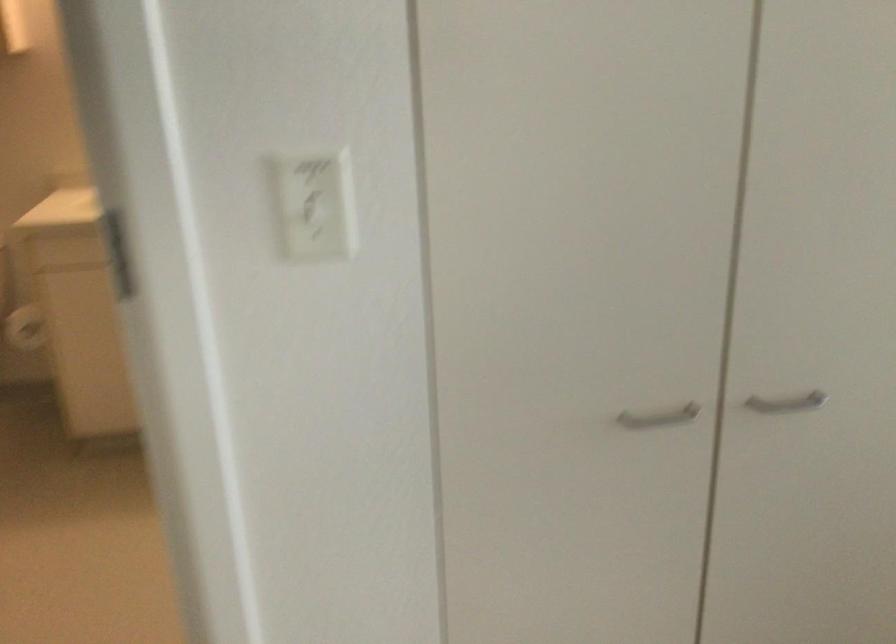
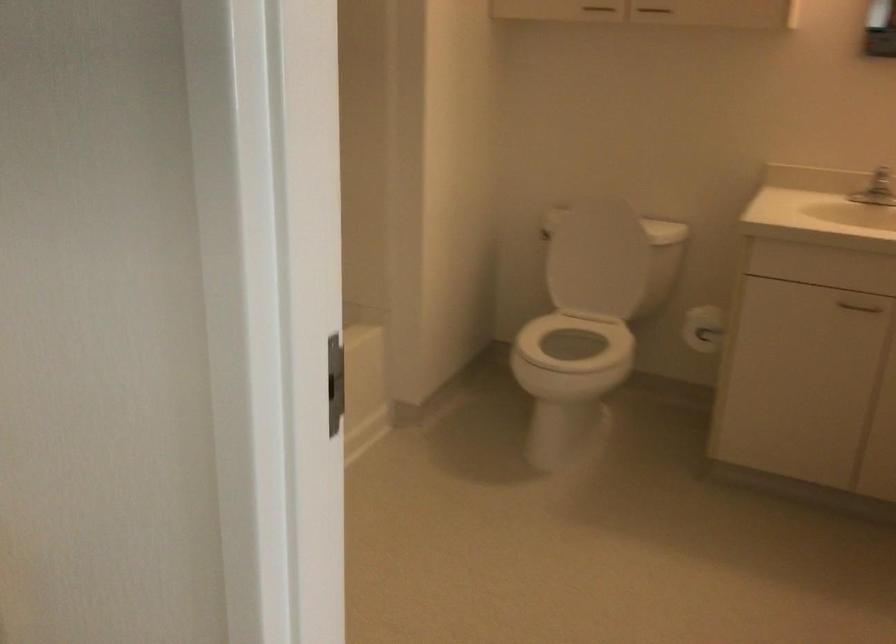
Question: The images are taken continuously from a first-person perspective. In which direction is your viewpoint rotating?

Choices:
 (A) Left
 (B) Right
 (C) Up
 (D) Down

Answer: (A)